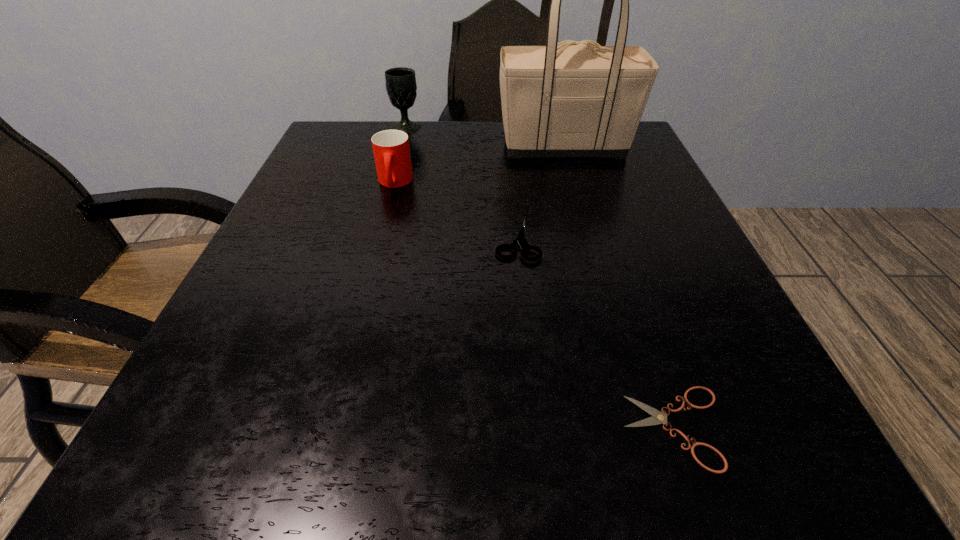
The height and width of the screenshot is (540, 960). I want to click on blank area located with handles facing forward on the shopping bag, so click(x=437, y=146).

Find the location of a particular element. vacant space situated 0.400m on the right of the chalice is located at coordinates (585, 127).

Locate an element on the screen. The image size is (960, 540). free region located on the side of the third shortest object with the handle is located at coordinates (378, 246).

Locate an element on the screen. free point located on the front of the farther shears is located at coordinates (529, 367).

Where is `vacant space located 0.050m on the left of the nearest object`? The width and height of the screenshot is (960, 540). vacant space located 0.050m on the left of the nearest object is located at coordinates pyautogui.click(x=581, y=428).

At what (x,y) coordinates should I click in order to perform the action: click on shopping bag positioned at the far edge. Please return your answer as a coordinate pair (x, y). This screenshot has height=540, width=960. Looking at the image, I should click on (579, 99).

You are a GUI agent. You are given a task and a screenshot of the screen. Output one action in this format:
    pyautogui.click(x=<x>, y=<y>)
    Task: Click on the chalice that is at the far edge
    The height and width of the screenshot is (540, 960).
    Given the screenshot: What is the action you would take?
    pyautogui.click(x=401, y=87)

Locate an element on the screen. The width and height of the screenshot is (960, 540). cup present at the far edge is located at coordinates (391, 149).

You are a GUI agent. You are given a task and a screenshot of the screen. Output one action in this format:
    pyautogui.click(x=<x>, y=<y>)
    Task: Click on the object located at the near edge
    Image resolution: width=960 pixels, height=540 pixels.
    Given the screenshot: What is the action you would take?
    pyautogui.click(x=658, y=417)

I want to click on chalice situated at the left edge, so click(x=401, y=87).